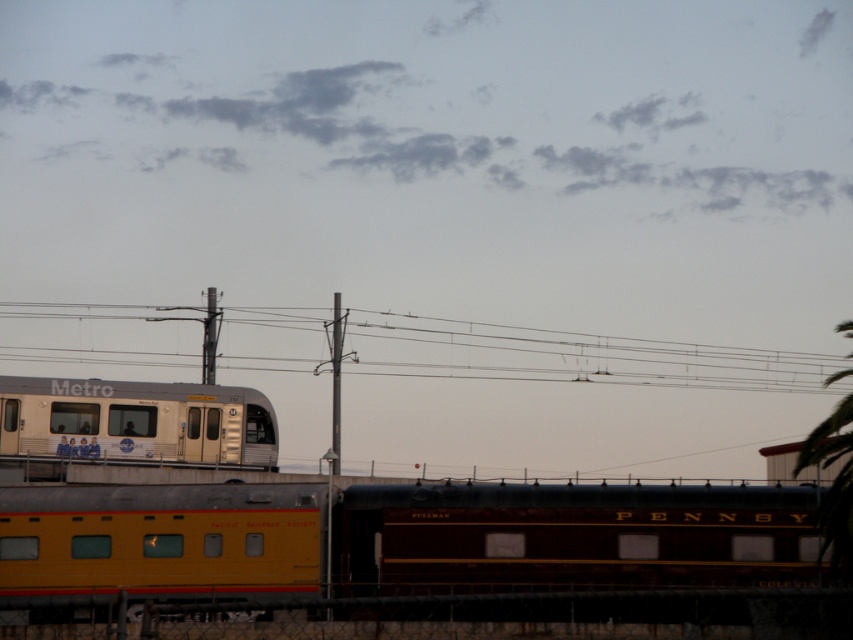
You are standing at the center of the train yard and want to take a photo of the silver metallic train at left. Which direction should you face to ensure the train is in the frame?

The silver metallic train at left is located at point (136, 420), so you should face towards the left side of the scene to capture it in your photo.

You are a maintenance worker needing to inspect the metallic wires at upper center and the silver metallic train at left. Given their positions, which object is higher from the ground?

The metallic wires at upper center are located above the silver metallic train at left, so the metallic wires at upper center are higher from the ground.